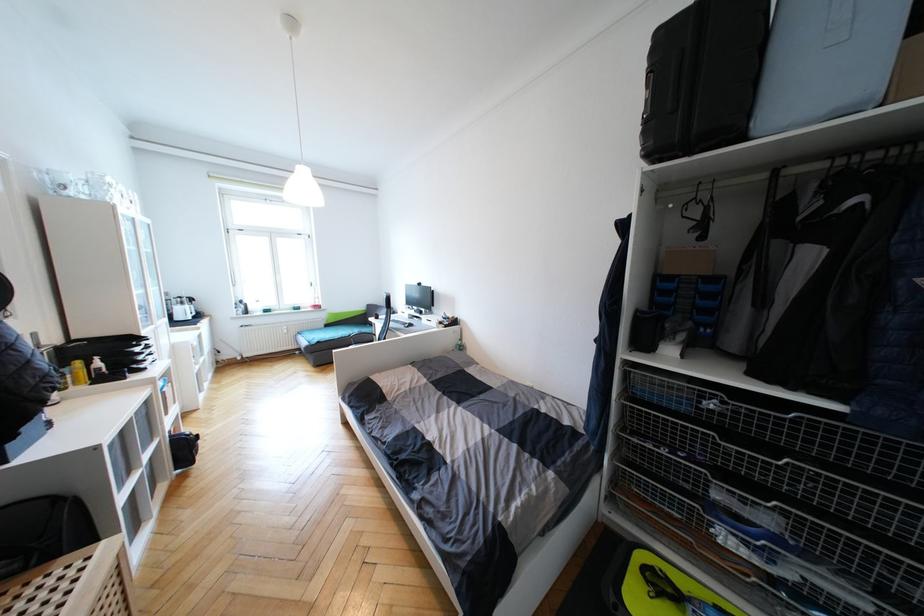
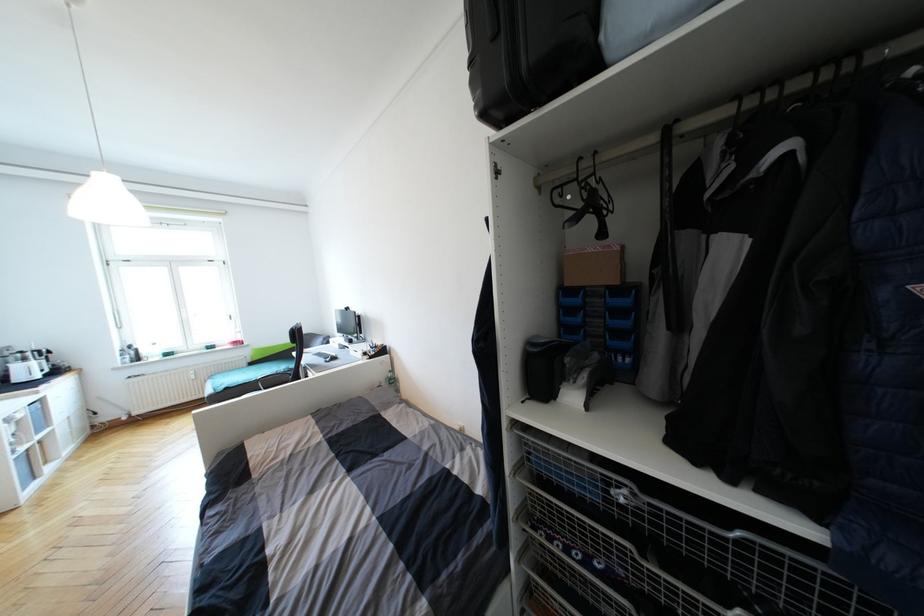
Find the pixel in the second image that matches pixel 649 123 in the first image.

(475, 65)